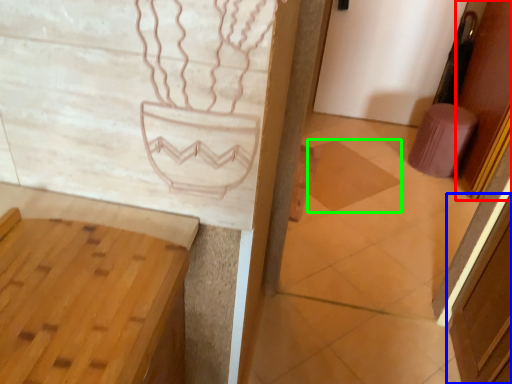
Question: Which is nearer to the door (highlighted by a red box)? screen door (highlighted by a blue box) or tile (highlighted by a green box).

Choices:
 (A) screen door
 (B) tile

Answer: (B)